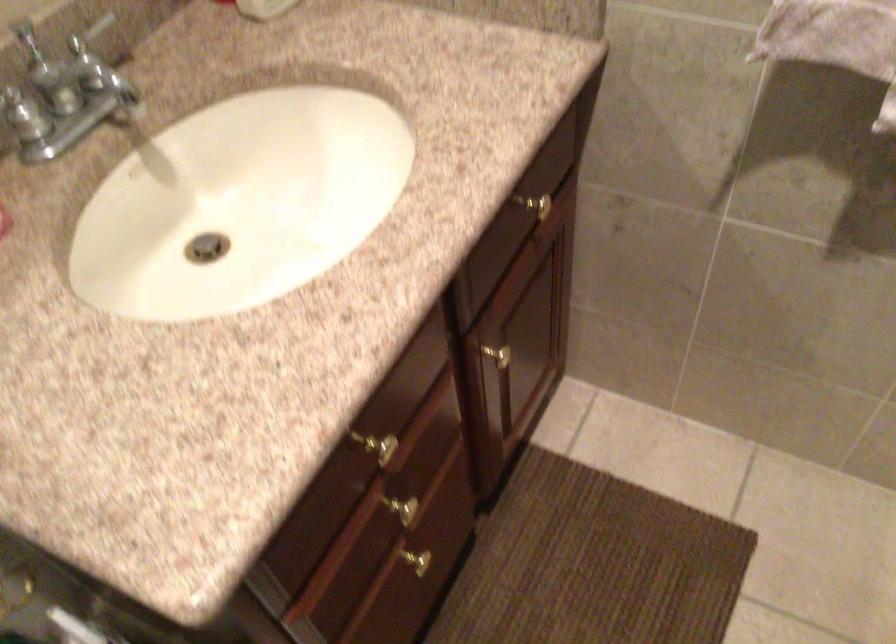
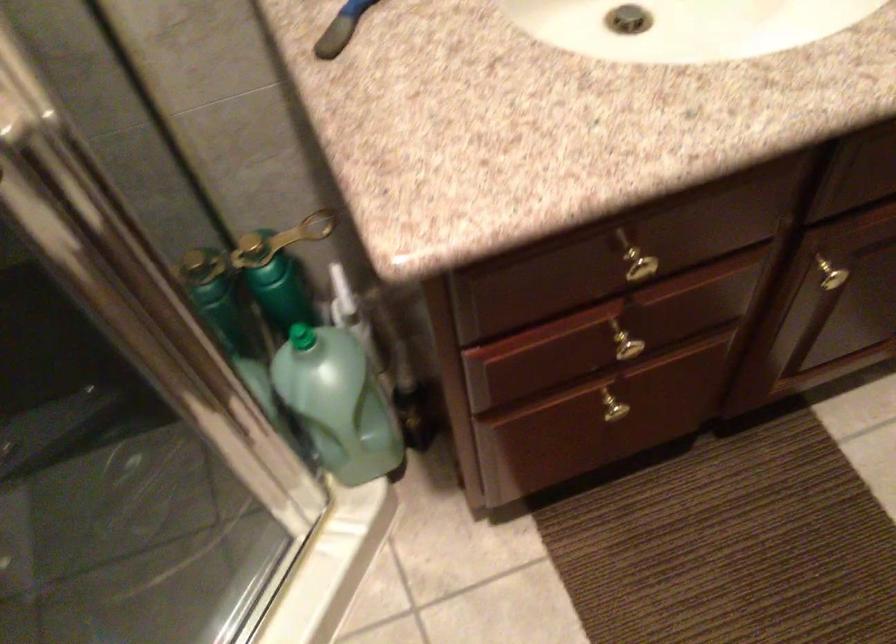
Where in the second image is the point corresponding to point 403,514 from the first image?

(625, 346)